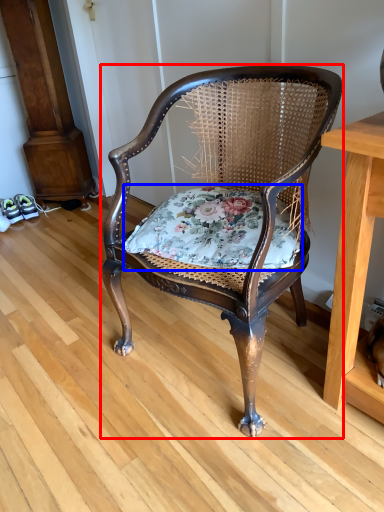
Question: Which object is further to the camera taking this photo, chair (highlighted by a red box) or blanket (highlighted by a blue box)?

Choices:
 (A) chair
 (B) blanket

Answer: (B)